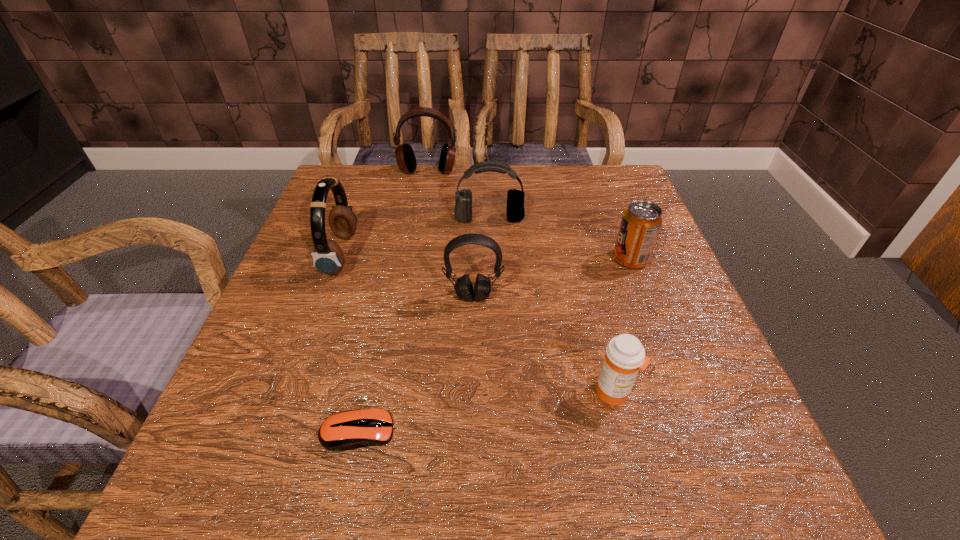
Where is `free spot located on the ear pads of the farthest object`? The image size is (960, 540). free spot located on the ear pads of the farthest object is located at coordinates (408, 286).

The height and width of the screenshot is (540, 960). Find the location of `vacant space located on the ear cup of the leftmost object`. vacant space located on the ear cup of the leftmost object is located at coordinates pyautogui.click(x=402, y=254).

Where is `vacant space positioned 0.120m on the headband of the second farthest object`? The image size is (960, 540). vacant space positioned 0.120m on the headband of the second farthest object is located at coordinates (491, 259).

At what (x,y) coordinates should I click in order to perform the action: click on blank space located 0.090m on the front-facing side of the third nearest object. Please return your answer as a coordinate pair (x, y). Looking at the image, I should click on click(473, 343).

This screenshot has width=960, height=540. I want to click on vacant space positioned on the left of the soda can, so click(545, 259).

Locate an element on the screen. This screenshot has height=540, width=960. vacant space located on the back of the second object from right to left is located at coordinates (599, 333).

This screenshot has width=960, height=540. Find the location of `vacant space located on the left of the shortest object`. vacant space located on the left of the shortest object is located at coordinates (238, 432).

Locate an element on the screen. This screenshot has height=540, width=960. object that is at the near edge is located at coordinates (346, 430).

Identify the location of headset at the left edge. (x=328, y=257).

You are a GUI agent. You are given a task and a screenshot of the screen. Output one action in this format:
    pyautogui.click(x=<x>, y=<y>)
    Task: Click on the computer mouse at the left edge
    This screenshot has width=960, height=540.
    Given the screenshot: What is the action you would take?
    pyautogui.click(x=346, y=430)